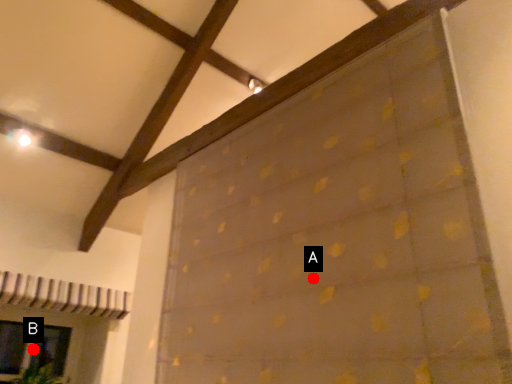
Question: Two points are circled on the image, labeled by A and B beside each circle. Which point is further to the camera?

Choices:
 (A) A is further
 (B) B is further

Answer: (B)